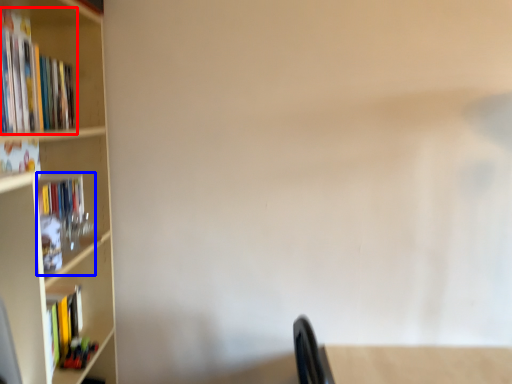
Question: Among these objects, which one is farthest to the camera, book (highlighted by a red box) or book (highlighted by a blue box)?

Choices:
 (A) book
 (B) book

Answer: (B)